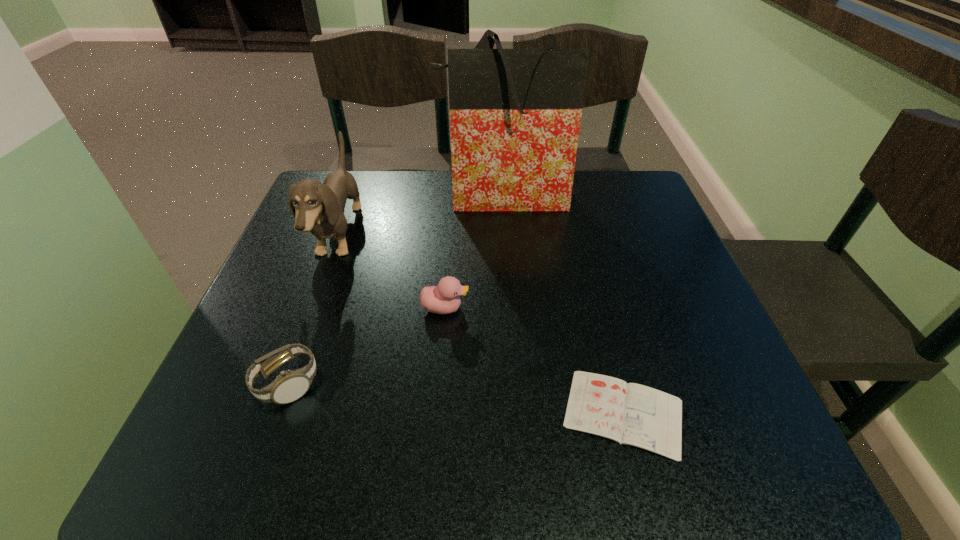
Where is `vacant point that satisfies the following two spatial constraints: 1. on the front side of the shopping bag; 2. on the left side of the diary`? The image size is (960, 540). vacant point that satisfies the following two spatial constraints: 1. on the front side of the shopping bag; 2. on the left side of the diary is located at coordinates (516, 413).

Where is `vacant space that satisfies the following two spatial constraints: 1. on the face of the watch; 2. on the back side of the shortest object`? The width and height of the screenshot is (960, 540). vacant space that satisfies the following two spatial constraints: 1. on the face of the watch; 2. on the back side of the shortest object is located at coordinates (276, 413).

Identify the location of vacant space that satisfies the following two spatial constraints: 1. on the front side of the tallest object; 2. on the face of the watch. Image resolution: width=960 pixels, height=540 pixels. (515, 383).

You are a GUI agent. You are given a task and a screenshot of the screen. Output one action in this format:
    pyautogui.click(x=<x>, y=<y>)
    Task: Click on the free spot that satisfies the following two spatial constraints: 1. on the front side of the tallest object; 2. on the face of the watch
    Image resolution: width=960 pixels, height=540 pixels.
    Given the screenshot: What is the action you would take?
    pyautogui.click(x=515, y=383)

Where is `vacant area in the image that satisfies the following two spatial constraints: 1. on the face of the watch; 2. on the back side of the shortest object`? Image resolution: width=960 pixels, height=540 pixels. vacant area in the image that satisfies the following two spatial constraints: 1. on the face of the watch; 2. on the back side of the shortest object is located at coordinates (276, 413).

The height and width of the screenshot is (540, 960). I want to click on vacant point that satisfies the following two spatial constraints: 1. at the face of the shortest object; 2. on the left side of the puppy, so click(274, 413).

Identify the location of free space that satisfies the following two spatial constraints: 1. on the front side of the tallest object; 2. on the left side of the shortest object. (516, 413).